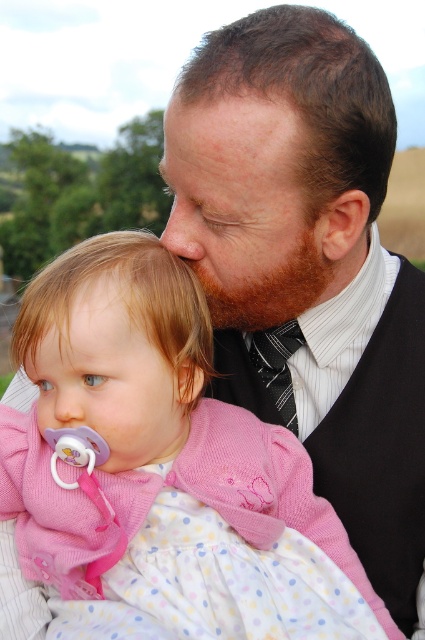
You are observing a father and daughter in a photograph. You notice the brown fuzzy beard at center and the matte skin nose at center. Which object is closer to the top of the image?

The brown fuzzy beard at center is shorter than matte skin nose at center, so the matte skin nose at center is closer to the top of the image.

Looking at this image, you are a photographer trying to capture a closeup of the man and the child in the scene. You notice two points marked in the image at coordinates point (53, 412) and point (193, 225). Which of these points is closer to your camera lens?

Point (53, 412) is closer to the camera lens than point (193, 225).